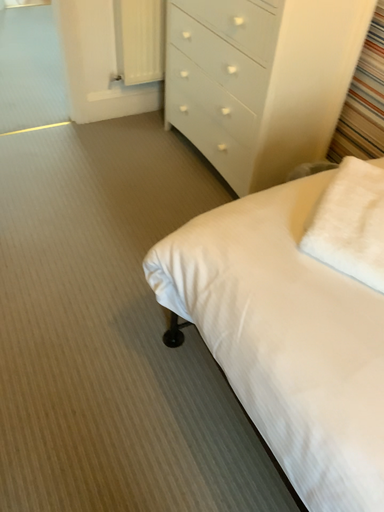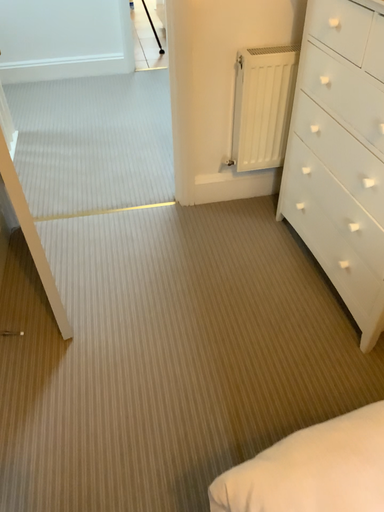
Question: Which way did the camera rotate in the video?

Choices:
 (A) rotated left
 (B) rotated right

Answer: (A)